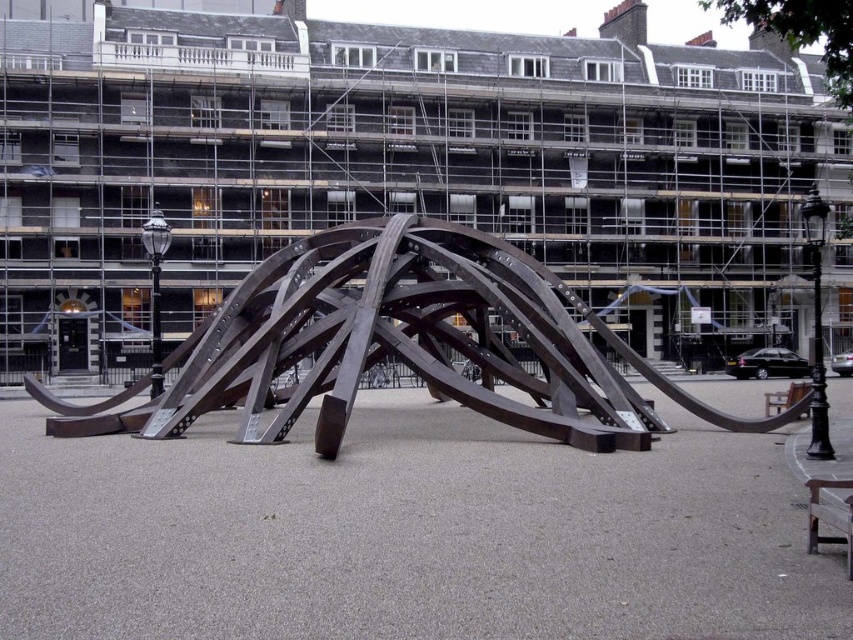
You are standing at the entrance of the public square and want to take a photo of the brown metallic sculpture at center. The entrance is at point A, which is located at coordinates approximately 0.3, 0.6. Can you walk directly towards the sculpture without any obstructions?

The brown metallic sculpture at center is located at point (398, 342). Since the entrance is at (511, 192), you can walk directly towards the sculpture as there are no obstructions mentioned in the scene description. The path appears clear between these coordinates.